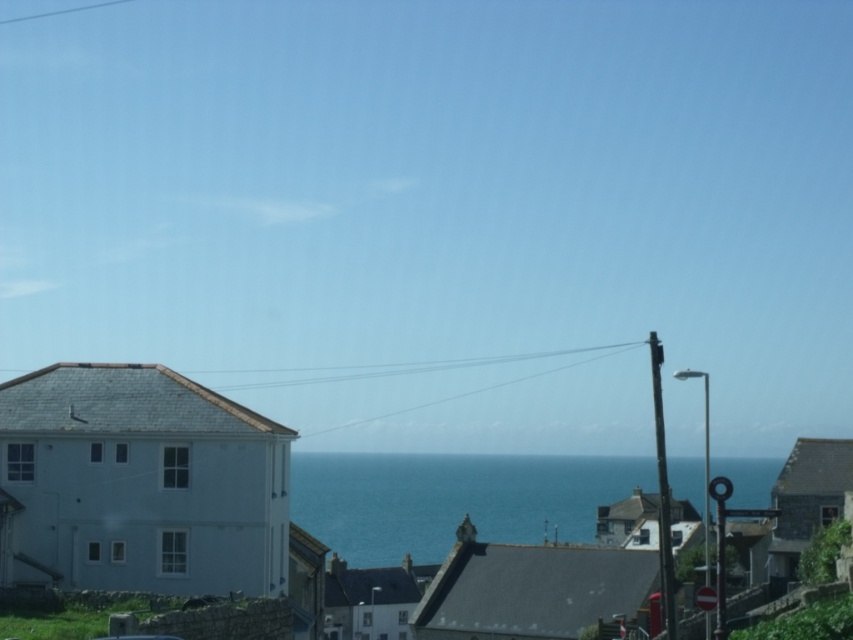
Question: Which object is closer to the camera taking this photo?

Choices:
 (A) white matte building at lower left
 (B) blue water at center

Answer: (B)

Question: Is white matte building at lower left below blue water at center?

Choices:
 (A) yes
 (B) no

Answer: (A)

Question: Is white matte building at lower left smaller than blue water at center?

Choices:
 (A) no
 (B) yes

Answer: (B)

Question: Among these objects, which one is farthest from the camera?

Choices:
 (A) blue water at center
 (B) white matte building at lower left

Answer: (B)

Question: Does white matte building at lower left appear on the right side of blue water at center?

Choices:
 (A) no
 (B) yes

Answer: (A)

Question: Which object appears farthest from the camera in this image?

Choices:
 (A) blue water at center
 (B) white matte building at lower left

Answer: (B)